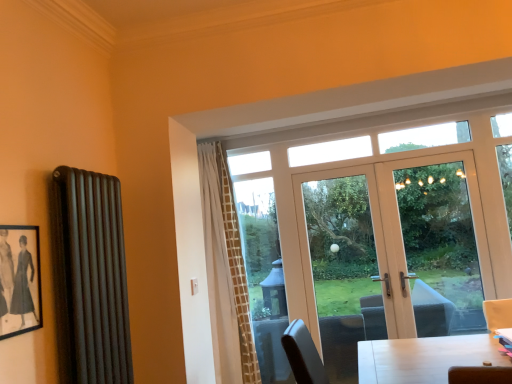
Identify the location of free space above white glossy door at center (from a real-world perspective). The width and height of the screenshot is (512, 384). (371, 153).